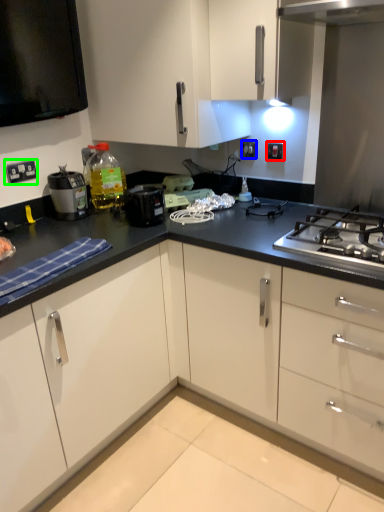
Question: Considering the real-world distances, which object is farthest from electric outlet (highlighted by a red box)? electric outlet (highlighted by a blue box) or electric outlet (highlighted by a green box)?

Choices:
 (A) electric outlet
 (B) electric outlet

Answer: (B)